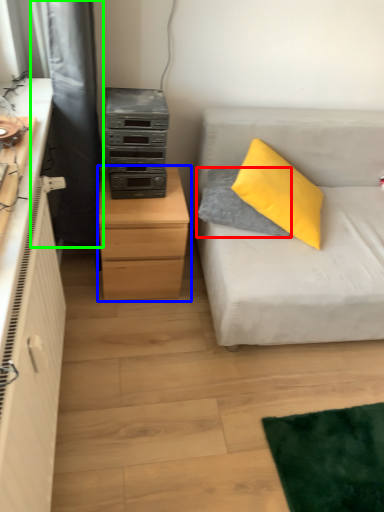
Question: Based on their relative distances, which object is nearer to pillow (highlighted by a red box)? Choose from chest of drawers (highlighted by a blue box) and curtain (highlighted by a green box).

Choices:
 (A) chest of drawers
 (B) curtain

Answer: (A)